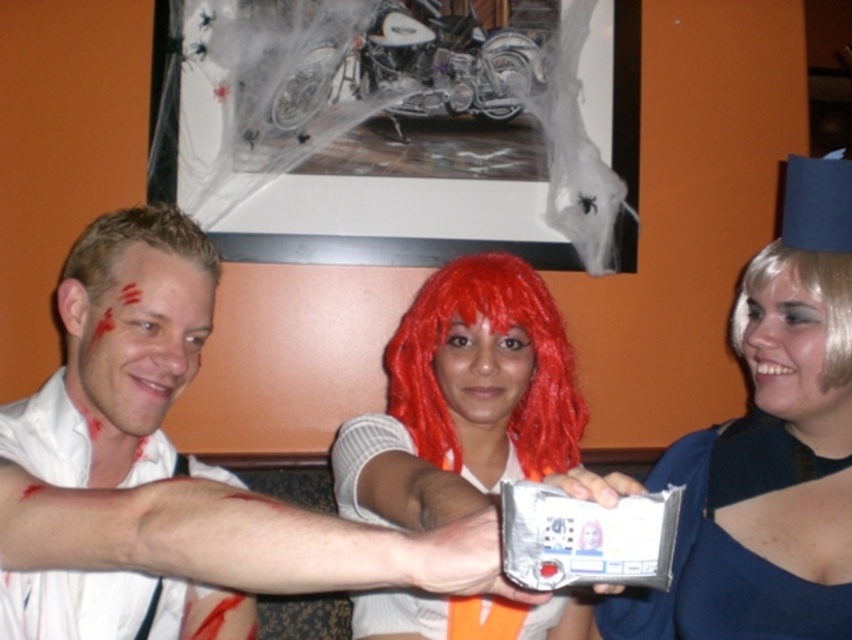
You are standing in front of the artwork featuring a motorcycle and spider webs. You notice two points marked in the scene. Which point is closer to you, point at (x=839, y=353) or point at (x=96, y=262)?

Point at (x=96, y=262) is closer to you because it is less further than point at (x=839, y=353).

You are a photographer at this venue and need to position two people so that their hair does not overlap in the photo. The blonde synthetic wig at right and the blonde hair at left are currently 32.12 inches apart. What is the minimum distance you should maintain between them to ensure their hair does not overlap?

The minimum distance to maintain between the blonde synthetic wig at right and the blonde hair at left to prevent hair overlap is 32.12 inches, as that is the current spacing which already ensures no overlap.

You are a photographer at this venue and need to capture a clear photo of both the white matte shirt at center and the blonde hair at left. Since you can only focus on one subject at a time, which one should you focus on to ensure the other is still in the background?

You should focus on the white matte shirt at center because it is in front of the blonde hair at left, so if you focus on the closer subject, the background subject will still be in focus.